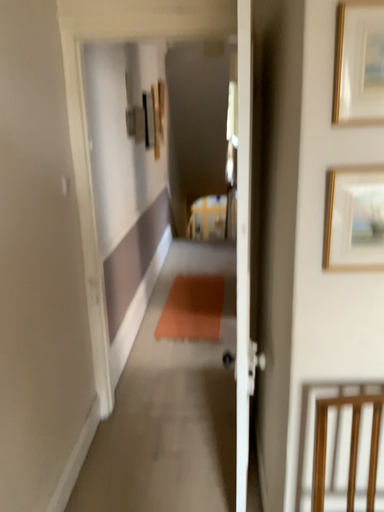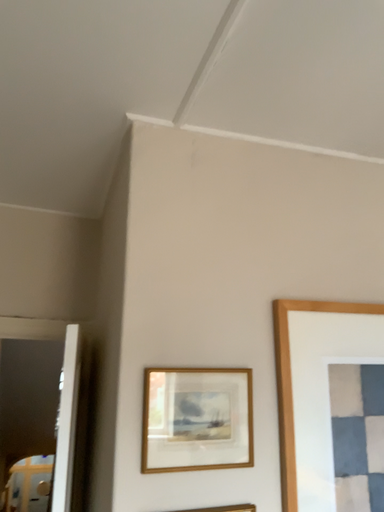
Question: How did the camera likely rotate when shooting the video?

Choices:
 (A) rotated downward
 (B) rotated upward

Answer: (B)